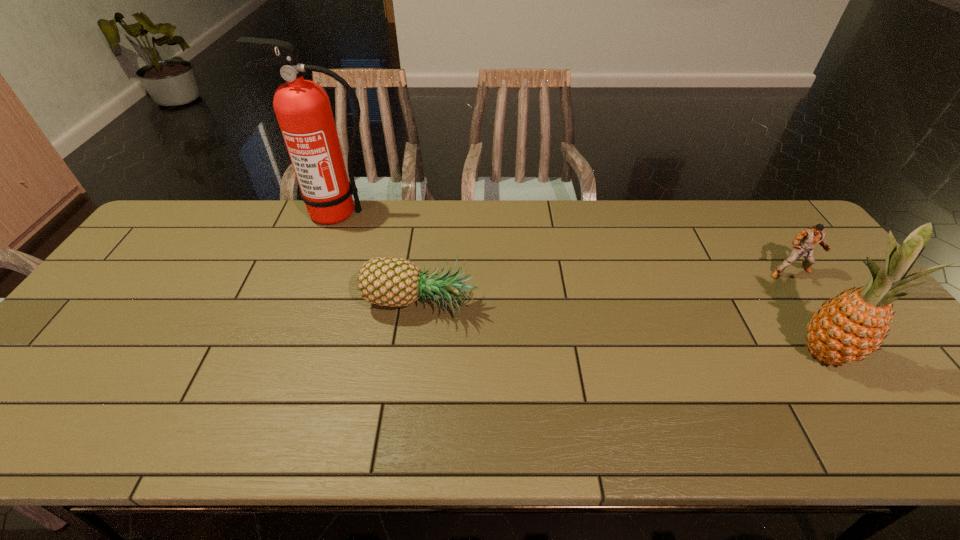
Locate an element on the screen. This screenshot has width=960, height=540. fire extinguisher is located at coordinates (303, 110).

I want to click on the leftmost object, so click(x=303, y=110).

This screenshot has width=960, height=540. Find the location of `the third shortest object`. the third shortest object is located at coordinates (848, 328).

Image resolution: width=960 pixels, height=540 pixels. I want to click on the right pineapple, so click(848, 328).

Where is `puncher`? puncher is located at coordinates (809, 238).

Where is `the shorter pineapple`? This screenshot has width=960, height=540. the shorter pineapple is located at coordinates (383, 281).

Locate an element on the screen. the second object from left to right is located at coordinates (383, 281).

Locate an element on the screen. This screenshot has height=540, width=960. free space located on the handle side of the leftmost object is located at coordinates (300, 317).

At what (x,y) coordinates should I click in order to perform the action: click on free space located 0.400m on the back of the third shortest object. Please return your answer as a coordinate pair (x, y). Looking at the image, I should click on (742, 231).

The width and height of the screenshot is (960, 540). I want to click on free space located 0.080m on the front-facing side of the second farthest object, so click(x=811, y=302).